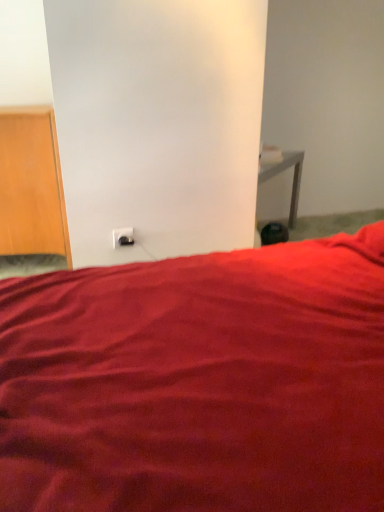
Question: Is the position of white plastic electric outlet at lower center less distant than that of matte red bed at center?

Choices:
 (A) yes
 (B) no

Answer: (B)

Question: Considering the relative sizes of white plastic electric outlet at lower center and matte red bed at center in the image provided, is white plastic electric outlet at lower center smaller than matte red bed at center?

Choices:
 (A) yes
 (B) no

Answer: (A)

Question: Is white plastic electric outlet at lower center positioned with its back to matte red bed at center?

Choices:
 (A) yes
 (B) no

Answer: (B)

Question: From a real-world perspective, is white plastic electric outlet at lower center on matte red bed at center?

Choices:
 (A) yes
 (B) no

Answer: (A)

Question: Is white plastic electric outlet at lower center shorter than matte red bed at center?

Choices:
 (A) no
 (B) yes

Answer: (B)

Question: Considering the positions of matte red bed at center and white plastic electric outlet at lower center in the image, is matte red bed at center wider or thinner than white plastic electric outlet at lower center?

Choices:
 (A) wide
 (B) thin

Answer: (A)

Question: In the image, is matte red bed at center positioned in front of or behind white plastic electric outlet at lower center?

Choices:
 (A) front
 (B) behind

Answer: (A)

Question: Considering the positions of matte red bed at center and white plastic electric outlet at lower center in the image, is matte red bed at center bigger or smaller than white plastic electric outlet at lower center?

Choices:
 (A) small
 (B) big

Answer: (B)

Question: From a real-world perspective, is matte red bed at center physically located above or below white plastic electric outlet at lower center?

Choices:
 (A) above
 (B) below

Answer: (B)

Question: In terms of width, does wooden door at left look wider or thinner when compared to white plastic electric outlet at lower center?

Choices:
 (A) wide
 (B) thin

Answer: (A)

Question: Looking at the image, does wooden door at left seem bigger or smaller compared to white plastic electric outlet at lower center?

Choices:
 (A) big
 (B) small

Answer: (A)

Question: From a real-world perspective, is wooden door at left positioned above or below white plastic electric outlet at lower center?

Choices:
 (A) above
 (B) below

Answer: (A)

Question: From the image's perspective, is wooden door at left located above or below white plastic electric outlet at lower center?

Choices:
 (A) above
 (B) below

Answer: (A)

Question: In terms of width, does matte red bed at center look wider or thinner when compared to wooden door at left?

Choices:
 (A) thin
 (B) wide

Answer: (B)

Question: Is point (185, 279) positioned closer to the camera than point (6, 136)?

Choices:
 (A) farther
 (B) closer

Answer: (B)